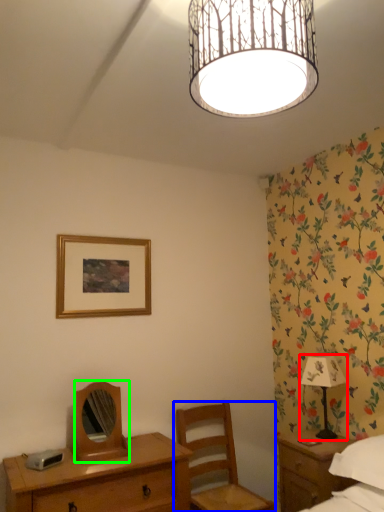
Question: Based on their relative distances, which object is farther from table lamp (highlighted by a red box)? Choose from chair (highlighted by a blue box) and mirror (highlighted by a green box).

Choices:
 (A) chair
 (B) mirror

Answer: (B)